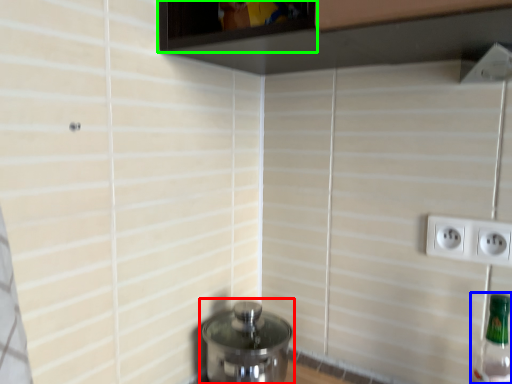
Question: Based on their relative distances, which object is farther from water heater (highlighted by a red box)? Choose from bottle (highlighted by a blue box) and window (highlighted by a green box).

Choices:
 (A) bottle
 (B) window

Answer: (B)